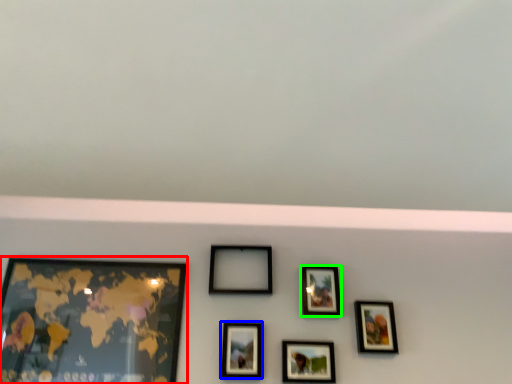
Question: Based on their relative distances, which object is nearer to picture frame (highlighted by a red box)? Choose from picture frame (highlighted by a blue box) and picture frame (highlighted by a green box).

Choices:
 (A) picture frame
 (B) picture frame

Answer: (A)